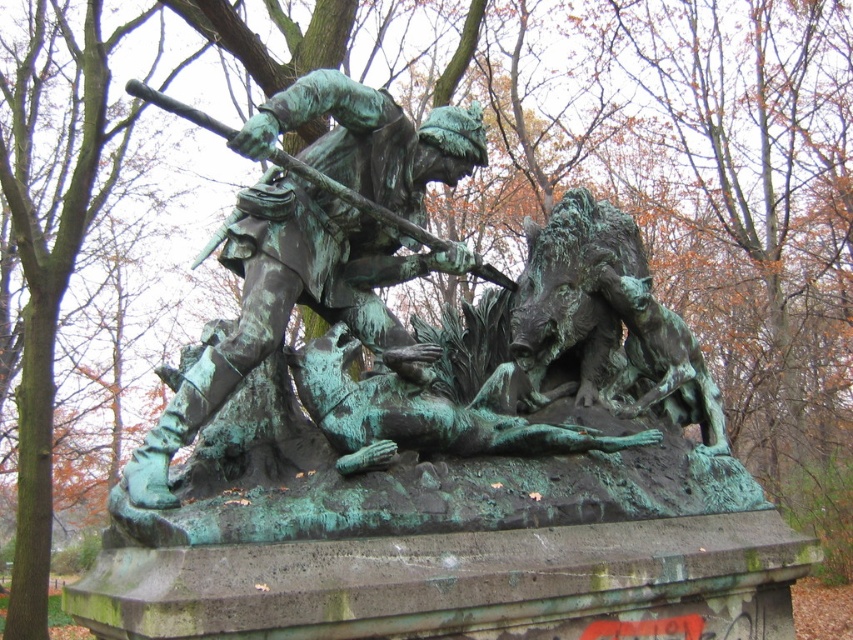
Question: Which point is farther to the camera?

Choices:
 (A) green patina statue at center
 (B) green patina bronze boar at center

Answer: (B)

Question: Is green patina statue at center to the right of green patina bronze boar at center from the viewer's perspective?

Choices:
 (A) no
 (B) yes

Answer: (A)

Question: Can you confirm if green patina statue at center is positioned to the right of green patina bronze boar at center?

Choices:
 (A) no
 (B) yes

Answer: (A)

Question: Can you confirm if green patina statue at center is thinner than green patina bronze boar at center?

Choices:
 (A) no
 (B) yes

Answer: (A)